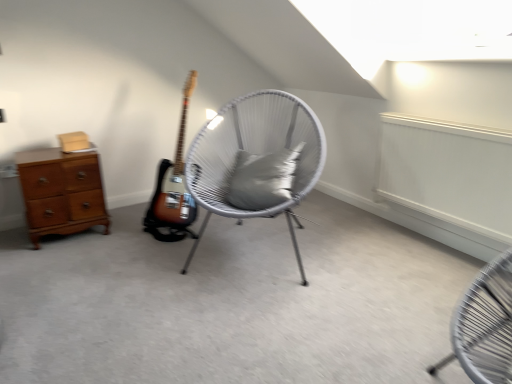
This screenshot has height=384, width=512. Identify the location of vacant area located to the right-hand side of white woven chair at center. (385, 258).